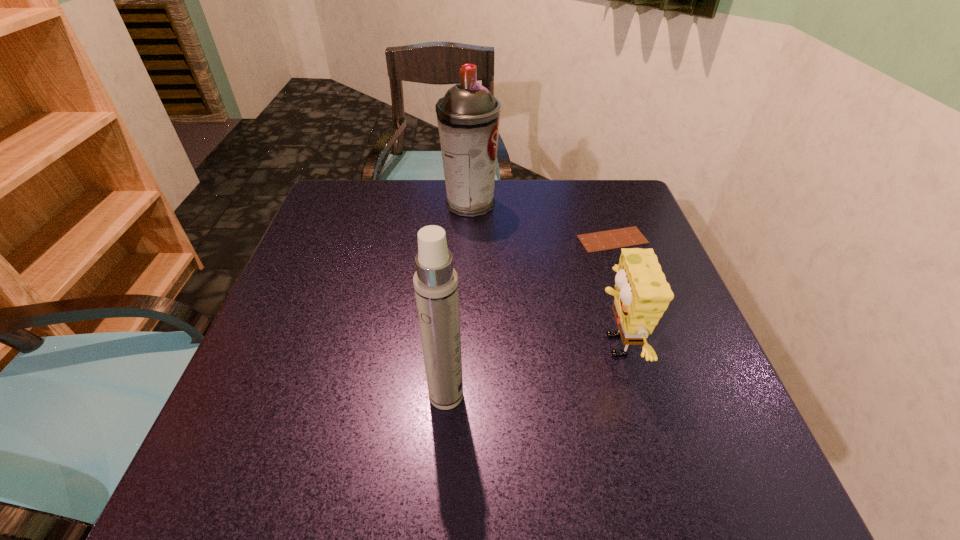
Locate an element on the screen. the farther aerosol can is located at coordinates (468, 116).

I want to click on the nearer aerosol can, so click(435, 281).

Where is `sponge`? The width and height of the screenshot is (960, 540). sponge is located at coordinates (642, 294).

This screenshot has width=960, height=540. Find the location of `chocolate bar`. chocolate bar is located at coordinates (624, 237).

The height and width of the screenshot is (540, 960). I want to click on the shortest object, so click(624, 237).

Locate an element on the screen. Image resolution: width=960 pixels, height=540 pixels. free space located on the left of the farthest object is located at coordinates (384, 204).

Where is `vacant position located 0.280m on the left of the nearer aerosol can`? vacant position located 0.280m on the left of the nearer aerosol can is located at coordinates (269, 395).

Where is `vacant area situated on the front-facing side of the sponge`? The height and width of the screenshot is (540, 960). vacant area situated on the front-facing side of the sponge is located at coordinates (482, 346).

Image resolution: width=960 pixels, height=540 pixels. Find the location of `vacant space located on the front-facing side of the sponge`. vacant space located on the front-facing side of the sponge is located at coordinates (487, 346).

Where is `free point located on the front-facing side of the sponge`? This screenshot has height=540, width=960. free point located on the front-facing side of the sponge is located at coordinates (398, 346).